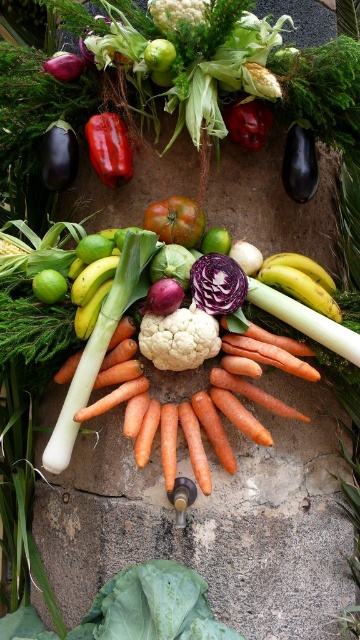
Question: Which point is closer to the camera?

Choices:
 (A) matte black eggplant at left
 (B) purple smooth cabbage at center
 (C) ripe red tomato at center
 (D) shiny red pepper at upper center

Answer: (C)

Question: Which of the following is the closest to the observer?

Choices:
 (A) shiny red pepper at upper center
 (B) green matte lime at center
 (C) green matte cauliflower at upper center
 (D) glossy red pepper at center

Answer: (C)

Question: Which object is closer to the camera taking this photo?

Choices:
 (A) white smooth cauliflower at center
 (B) glossy red pepper at center
 (C) purple smooth onion at center
 (D) matte black eggplant at left

Answer: (C)

Question: Does shiny red pepper at upper center have a smaller size compared to green matte lime at center?

Choices:
 (A) no
 (B) yes

Answer: (A)

Question: Considering the relative positions of purple smooth onion at center and purple smooth cabbage at center in the image provided, where is purple smooth onion at center located with respect to purple smooth cabbage at center?

Choices:
 (A) below
 (B) above

Answer: (A)

Question: Can you confirm if white smooth cauliflower at center is smaller than purple smooth cabbage at center?

Choices:
 (A) yes
 (B) no

Answer: (B)